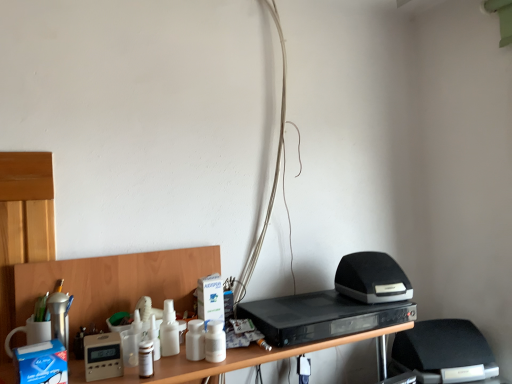
Question: From a real-world perspective, is beige plastic thermostat at lower left, the 2th appliance positioned from the top, positioned over black matte speaker at right, which appears as the second appliance when viewed from the left, based on gravity?

Choices:
 (A) no
 (B) yes

Answer: (A)

Question: Is beige plastic thermostat at lower left, the 2th appliance positioned from the back, at the right side of black matte speaker at right, marked as the second appliance in a front-to-back arrangement?

Choices:
 (A) no
 (B) yes

Answer: (A)

Question: Considering the relative sizes of beige plastic thermostat at lower left, the 2th appliance positioned from the back, and black matte speaker at right, which appears as the 1th appliance when viewed from the back, in the image provided, is beige plastic thermostat at lower left, the 2th appliance positioned from the back, bigger than black matte speaker at right, which appears as the 1th appliance when viewed from the back,?

Choices:
 (A) no
 (B) yes

Answer: (A)

Question: Is beige plastic thermostat at lower left, placed as the first appliance when sorted from front to back, positioned in front of black matte speaker at right, which ranks as the 1th appliance in right-to-left order?

Choices:
 (A) no
 (B) yes

Answer: (B)

Question: Is there a large distance between beige plastic thermostat at lower left, the 2th appliance positioned from the back, and black matte speaker at right, which is the second appliance from bottom to top?

Choices:
 (A) no
 (B) yes

Answer: (A)

Question: Choose the correct answer: Is beige plastic thermostat at lower left, which appears as the 2th appliance when viewed from the right, inside black plastic dvd player at center or outside it?

Choices:
 (A) inside
 (B) outside

Answer: (B)

Question: In terms of width, does beige plastic thermostat at lower left, placed as the first appliance when sorted from front to back, look wider or thinner when compared to black plastic dvd player at center?

Choices:
 (A) wide
 (B) thin

Answer: (B)

Question: Considering the positions of point (93, 360) and point (378, 311), is point (93, 360) closer or farther from the camera than point (378, 311)?

Choices:
 (A) closer
 (B) farther

Answer: (A)

Question: Considering the positions of beige plastic thermostat at lower left, acting as the first appliance starting from the bottom, and black plastic dvd player at center in the image, is beige plastic thermostat at lower left, acting as the first appliance starting from the bottom, bigger or smaller than black plastic dvd player at center?

Choices:
 (A) small
 (B) big

Answer: (A)

Question: Is white matte wires at center taller or shorter than beige plastic thermostat at lower left, which appears as the 2th appliance when viewed from the right?

Choices:
 (A) tall
 (B) short

Answer: (A)

Question: Is white matte wires at center situated inside beige plastic thermostat at lower left, the 2th appliance positioned from the back, or outside?

Choices:
 (A) inside
 (B) outside

Answer: (B)

Question: From a real-world perspective, is white matte wires at center positioned above or below beige plastic thermostat at lower left, acting as the first appliance starting from the bottom?

Choices:
 (A) below
 (B) above

Answer: (B)

Question: Based on their sizes in the image, would you say white matte wires at center is bigger or smaller than beige plastic thermostat at lower left, the 2th appliance positioned from the back?

Choices:
 (A) small
 (B) big

Answer: (B)

Question: Considering the positions of black matte speaker at right, which appears as the 1th appliance when viewed from the back, and black plastic dvd player at center in the image, is black matte speaker at right, which appears as the 1th appliance when viewed from the back, bigger or smaller than black plastic dvd player at center?

Choices:
 (A) small
 (B) big

Answer: (A)

Question: Is point (377, 299) closer or farther from the camera than point (298, 296)?

Choices:
 (A) closer
 (B) farther

Answer: (A)